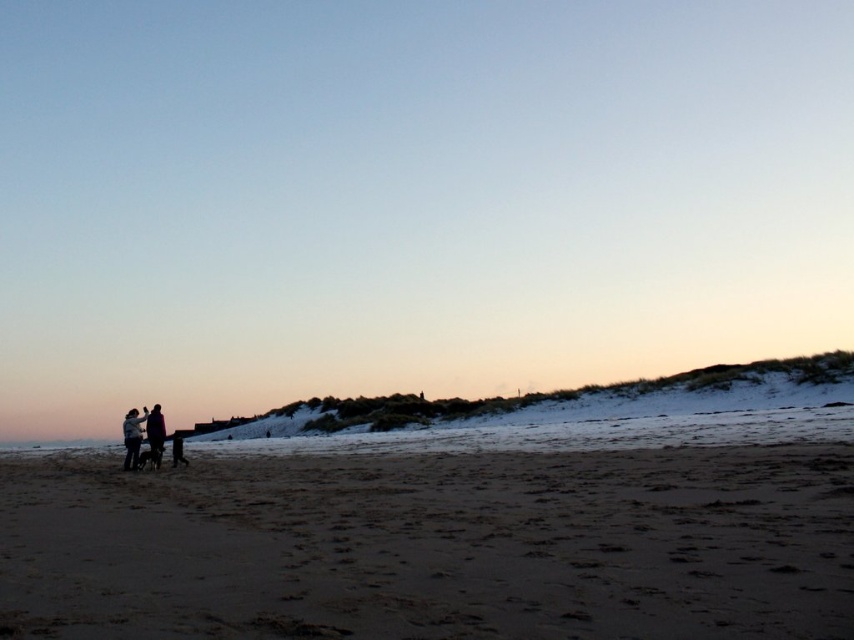
You are standing at the center of the beach and want to walk to the brown sandy beach at lower left. Which direction should you head?

You should head towards the lower left direction to reach the brown sandy beach at lower left.

You are a photographer trying to capture the two figures in the beach scene. Since both the silhouette clothing at lower left and dark blue jacket at lower left are in the lower left area, which one is closer to the camera?

The silhouette clothing at lower left is in front of the dark blue jacket at lower left, so it is closer to the camera.